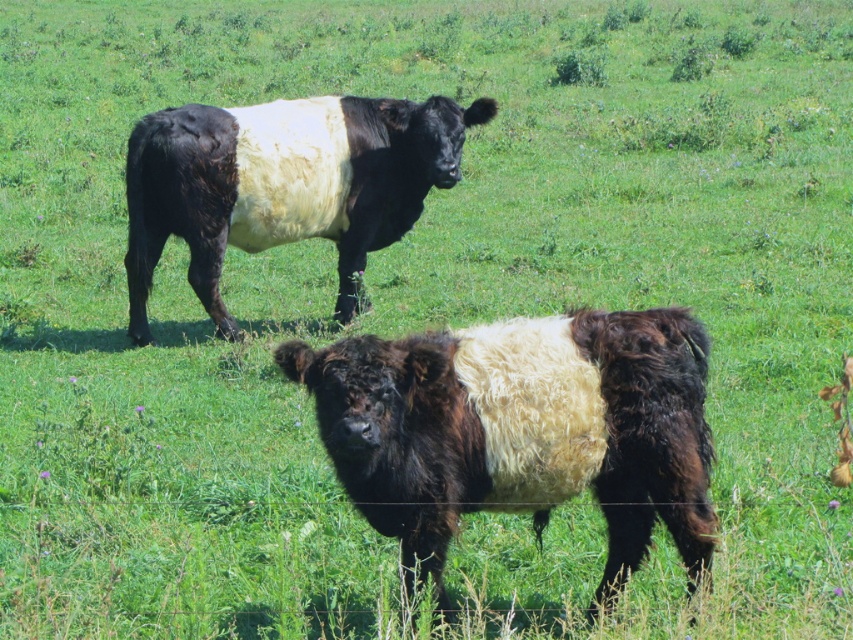
Question: Which object appears farthest from the camera in this image?

Choices:
 (A) black woolly bull at upper center
 (B) fuzzy brown and white bull at center

Answer: (A)

Question: Does fuzzy brown and white bull at center come in front of black woolly bull at upper center?

Choices:
 (A) yes
 (B) no

Answer: (A)

Question: Which of the following is the closest to the observer?

Choices:
 (A) (706, 547)
 (B) (256, 113)

Answer: (A)

Question: Is fuzzy brown and white bull at center smaller than black woolly bull at upper center?

Choices:
 (A) yes
 (B) no

Answer: (A)

Question: Can you confirm if fuzzy brown and white bull at center is wider than black woolly bull at upper center?

Choices:
 (A) no
 (B) yes

Answer: (A)

Question: Which point is closer to the camera taking this photo?

Choices:
 (A) (543, 413)
 (B) (238, 188)

Answer: (A)